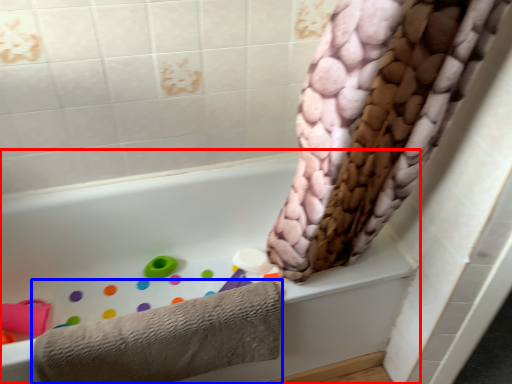
Question: Which point is closer to the camera, bathtub (highlighted by a red box) or towel (highlighted by a blue box)?

Choices:
 (A) bathtub
 (B) towel

Answer: (A)